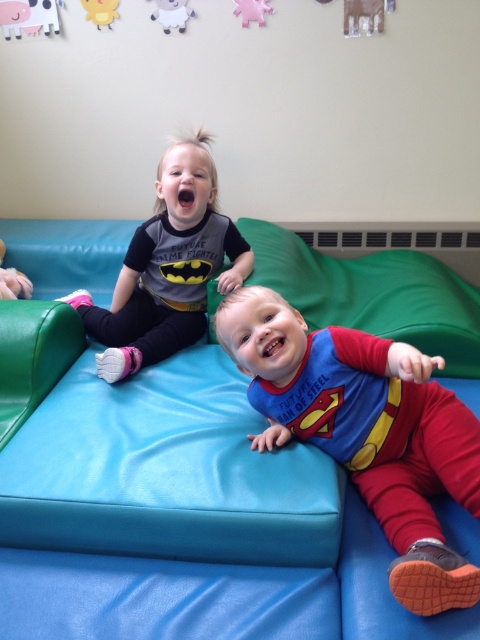
Does yellow plush sheep at upper left have a smaller size compared to pink fabric toy at upper center?

Yes.

Does yellow plush sheep at upper left appear over pink fabric toy at upper center?

Yes.

In the scene shown: Measure the distance between yellow plush sheep at upper left and camera.

yellow plush sheep at upper left and camera are 2.26 meters apart from each other.

At what (x,y) coordinates should I click in order to perform the action: click on yellow plush sheep at upper left. Please return your answer as a coordinate pair (x, y). Looking at the image, I should click on (100, 10).

Which is in front, point (129, 348) or point (82, 4)?

Point (129, 348) is in front.

At what (x,y) coordinates should I click in order to perform the action: click on matte black shirt at upper left. Please return your answer as a coordinate pair (x, y). This screenshot has height=640, width=480. Looking at the image, I should click on (168, 268).

Does white plush sheep at upper center appear under yellow plush sheep at upper left?

Correct, white plush sheep at upper center is located below yellow plush sheep at upper left.

Who is positioned more to the left, white plush sheep at upper center or yellow plush sheep at upper left?

Positioned to the left is yellow plush sheep at upper left.

The image size is (480, 640). Identify the location of white plush sheep at upper center. (171, 13).

You are a GUI agent. You are given a task and a screenshot of the screen. Output one action in this format:
    pyautogui.click(x=<x>, y=<y>)
    Task: Click on the white plush sheep at upper center
    Image resolution: width=480 pixels, height=640 pixels.
    Given the screenshot: What is the action you would take?
    pyautogui.click(x=171, y=13)